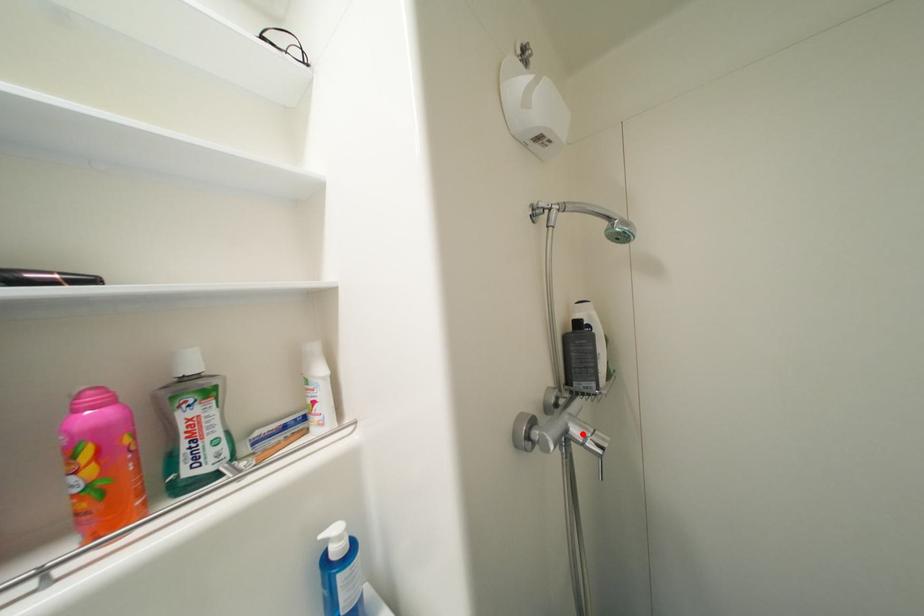
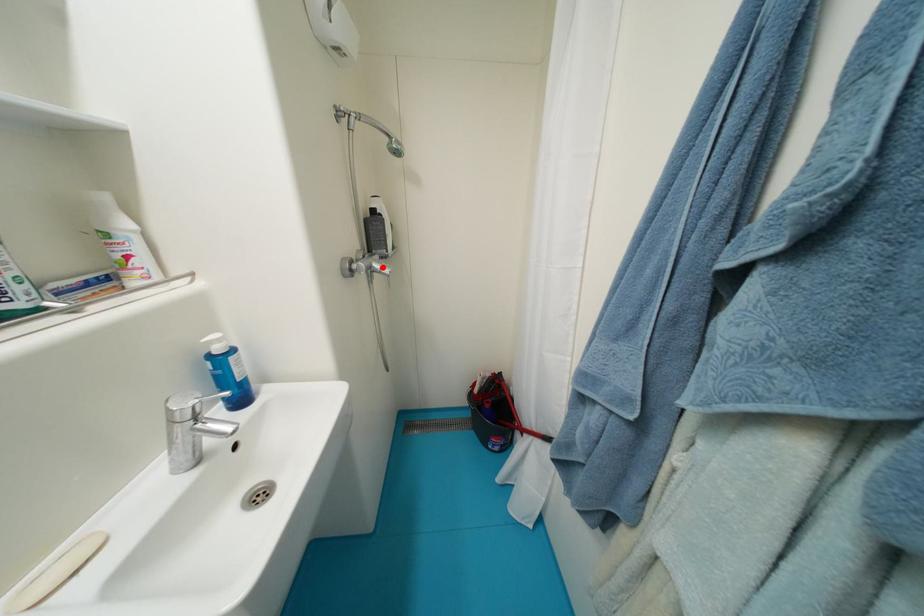
I am providing you with two images of the same scene from different viewpoints. A red point is marked on the first image and another point is marked on the second image. Is the red point in image1 aligned with the point shown in image2?

Yes